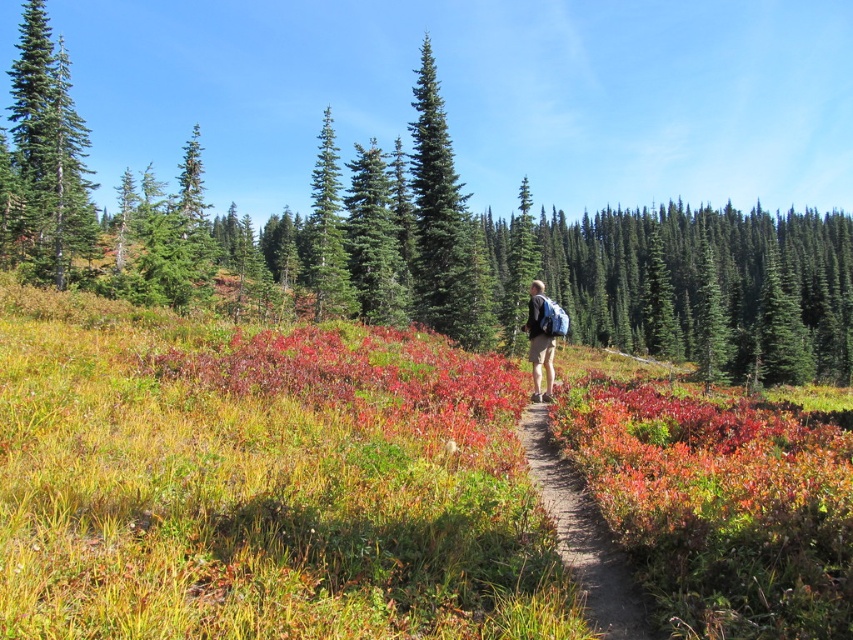
Who is higher up, vibrant red leaves at center or brown dirt path at center?

vibrant red leaves at center

Who is more distant from viewer, [663,516] or [531,470]?

The point [531,470] is behind.

Identify the location of vibrant red leaves at center. This screenshot has width=853, height=640. (704, 467).

Can you confirm if brown dirt path at center is taller than matte blue backpack at center?

No, brown dirt path at center is not taller than matte blue backpack at center.

What do you see at coordinates (583, 536) in the screenshot? I see `brown dirt path at center` at bounding box center [583, 536].

The image size is (853, 640). Find the location of `brown dirt path at center`. brown dirt path at center is located at coordinates (583, 536).

Does green matte evergreen tree at left appear on the right side of matte blue backpack at center?

Incorrect, green matte evergreen tree at left is not on the right side of matte blue backpack at center.

Who is positioned more to the right, green matte evergreen tree at left or matte blue backpack at center?

matte blue backpack at center is more to the right.

At what (x,y) coordinates should I click in order to perform the action: click on green matte evergreen tree at left. Please return your answer as a coordinate pair (x, y). The height and width of the screenshot is (640, 853). Looking at the image, I should click on (48, 154).